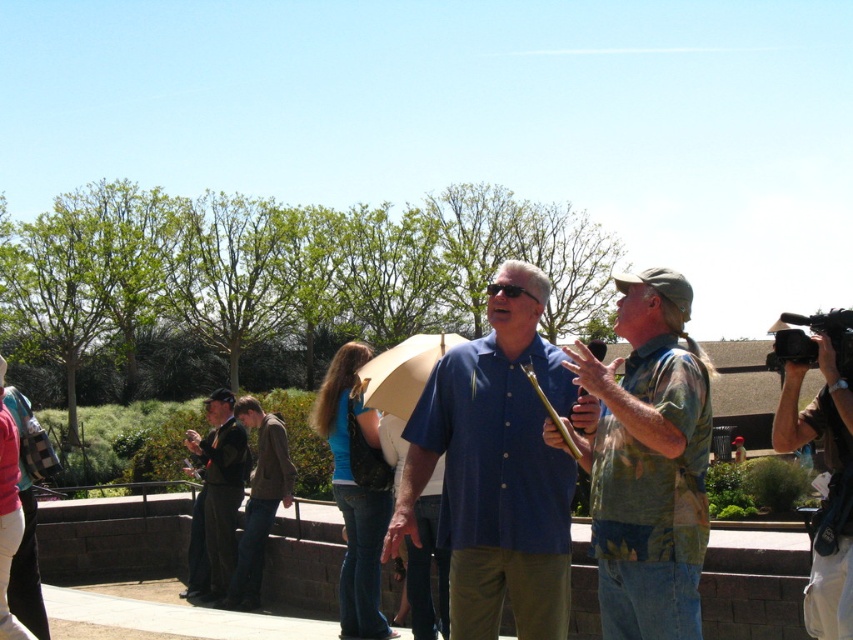
Does camo-patterned shirt at center-right appear on the right side of dark blue uniform at center?

Correct, you'll find camo-patterned shirt at center-right to the right of dark blue uniform at center.

Locate an element on the screen. This screenshot has height=640, width=853. camo-patterned shirt at center-right is located at coordinates (648, 464).

Is point (613, 372) less distant than point (231, 406)?

That is True.

The width and height of the screenshot is (853, 640). Identify the location of camo-patterned shirt at center-right. (648, 464).

Describe the element at coordinates (825, 452) in the screenshot. I see `camouflage-patterned shirt at right` at that location.

Can you confirm if camouflage-patterned shirt at right is positioned above brown leather jacket at center?

Correct, camouflage-patterned shirt at right is located above brown leather jacket at center.

This screenshot has width=853, height=640. I want to click on camouflage-patterned shirt at right, so click(825, 452).

Measure the distance between dark blue uniform at center and camera.

The distance of dark blue uniform at center from camera is 11.20 meters.

Between point (223, 429) and point (236, 600), which one is positioned in front?

Point (236, 600)

From the picture: Who is more distant from viewer, (241, 452) or (241, 566)?

The point (241, 452) is behind.

Locate an element on the screen. This screenshot has height=640, width=853. dark blue uniform at center is located at coordinates (216, 497).